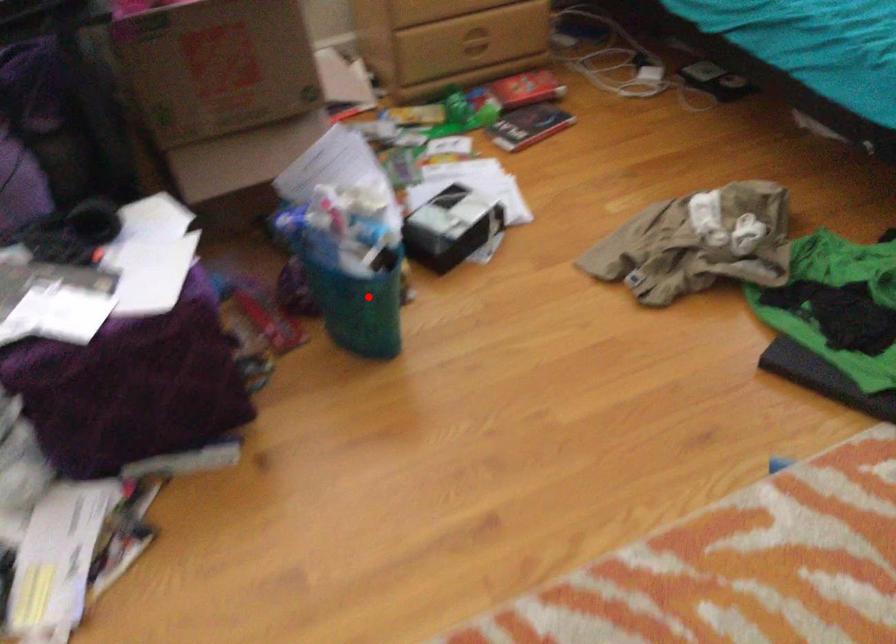
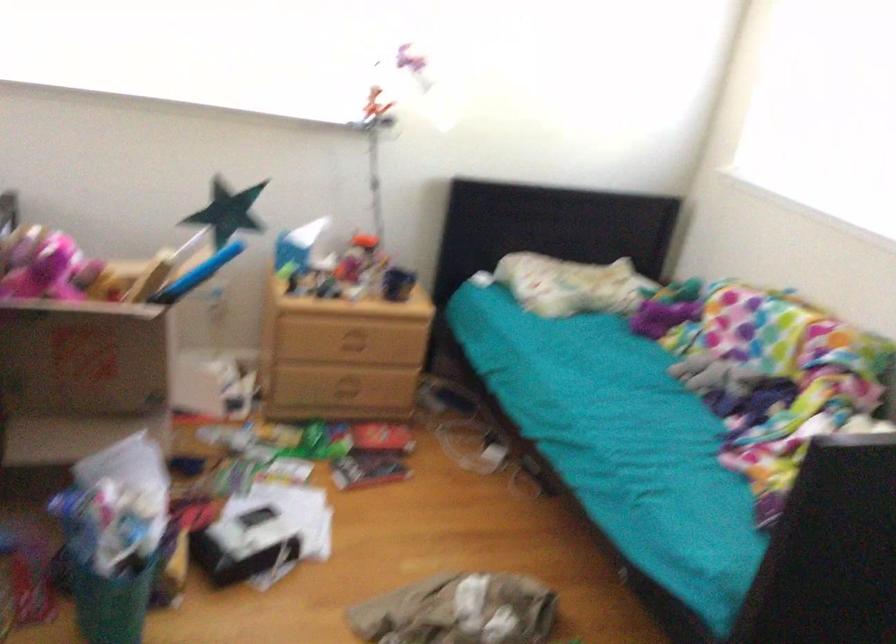
Find the pixel in the second image that matches the highlighted location in the first image.

(108, 592)